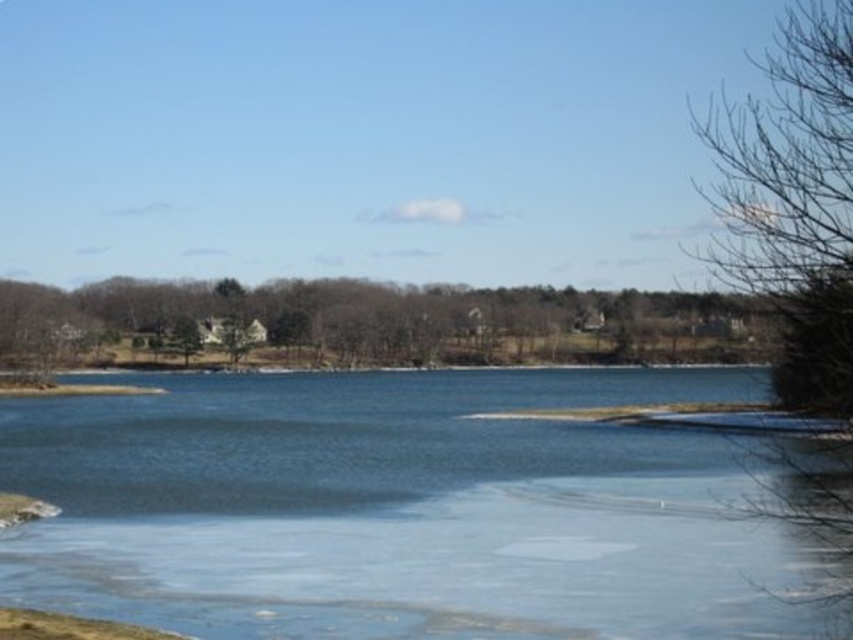
Can you confirm if clear ice at center is shorter than brown textured tree at center?

Correct, clear ice at center is not as tall as brown textured tree at center.

Is point (596, 396) behind point (512, 292)?

No, it is not.

Identify the location of clear ice at center. (398, 509).

Is bare branches at right shorter than green matte tree at center?

No, bare branches at right is not shorter than green matte tree at center.

Which is more to the left, bare branches at right or green matte tree at center?

From the viewer's perspective, green matte tree at center appears more on the left side.

The image size is (853, 640). In order to click on bare branches at right in this screenshot , I will do `click(798, 244)`.

Is clear ice at center positioned at the back of bare branches at right?

Yes, it is behind bare branches at right.

Who is shorter, clear ice at center or bare branches at right?

clear ice at center is shorter.

I want to click on clear ice at center, so click(398, 509).

You are a GUI agent. You are given a task and a screenshot of the screen. Output one action in this format:
    pyautogui.click(x=<x>, y=<y>)
    Task: Click on the clear ice at center
    The image size is (853, 640).
    Given the screenshot: What is the action you would take?
    pyautogui.click(x=398, y=509)